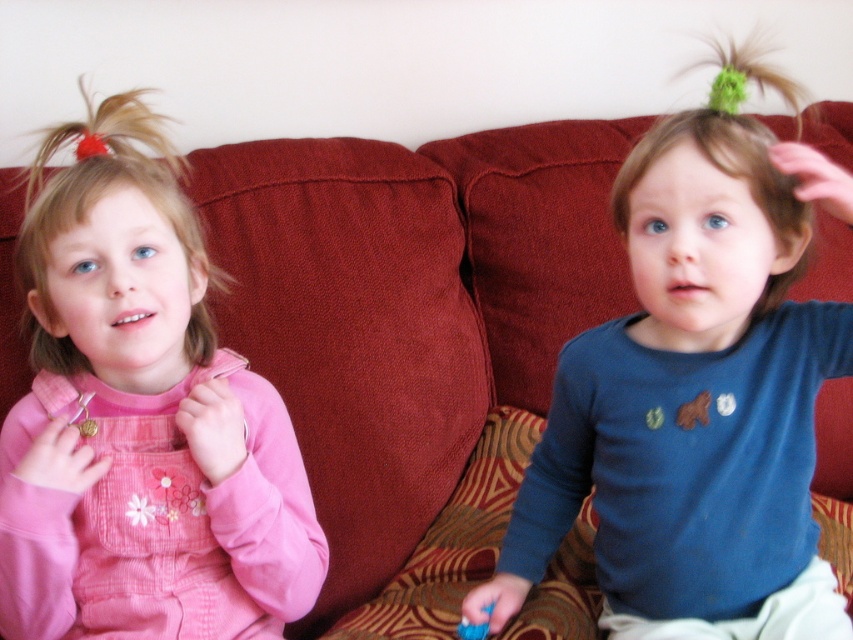
What are the coordinates of the blue cotton shirt at center?

The blue cotton shirt at center is located at point (695, 392).

You are a photographer trying to capture a closeup of the brown fuzzy hair at upper right and the blue plastic brush at lower center. Which object is positioned closer to the camera?

The brown fuzzy hair at upper right is closer to the viewer than the blue plastic brush at lower center, so it would be positioned closer to the camera.

In the scene shown: You are a photographer setting up for a family portrait. You notice the brown fuzzy hair at upper right and the blue plastic brush at lower center in the scene. Which object is taller when viewed from the camera position?

The brown fuzzy hair at upper right is taller than the blue plastic brush at lower center.